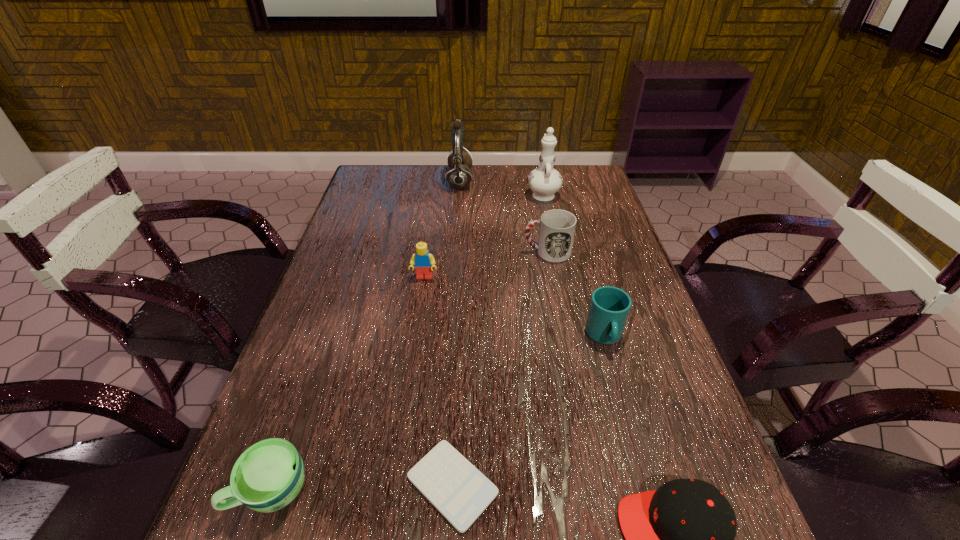
At what (x,y) coordinates should I click in order to perform the action: click on chinaware at the far edge. Please return your answer as a coordinate pair (x, y). Looking at the image, I should click on (544, 181).

Identify the location of object at the left edge. (267, 476).

I want to click on chinaware that is at the right edge, so click(544, 181).

The height and width of the screenshot is (540, 960). What are the coordinates of `object present at the far right corner` in the screenshot? It's located at (544, 181).

This screenshot has width=960, height=540. I want to click on free point at the far edge, so click(x=416, y=181).

The width and height of the screenshot is (960, 540). I want to click on vacant space at the left edge of the desktop, so click(330, 347).

The image size is (960, 540). What are the coordinates of `vacant space at the right edge of the desktop` in the screenshot? It's located at (628, 355).

You are a GUI agent. You are given a task and a screenshot of the screen. Output one action in this format:
    pyautogui.click(x=<x>, y=<y>)
    Task: Click on the free space at the far right corner of the desktop
    
    Given the screenshot: What is the action you would take?
    pyautogui.click(x=596, y=176)

Image resolution: width=960 pixels, height=540 pixels. In order to click on vacant area that lies between the chinaware and the shortest object in this screenshot , I will do `click(497, 339)`.

At what (x,y) coordinates should I click in order to perform the action: click on unoccupied area between the fifth nearest object and the earphone. Please return your answer as a coordinate pair (x, y). This screenshot has width=960, height=540. Looking at the image, I should click on (442, 230).